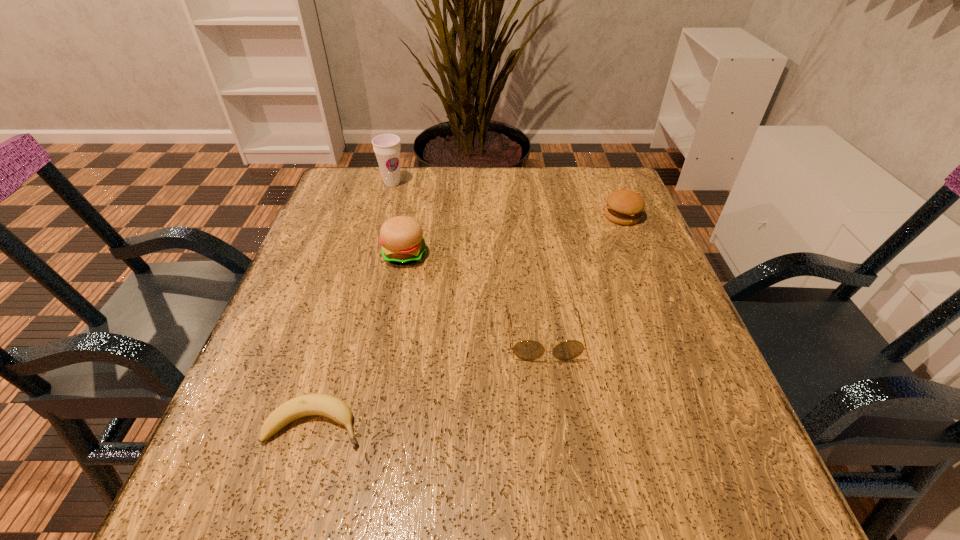
At what (x,y) coordinates should I click in order to perform the action: click on object that is at the far left corner. Please return your answer as a coordinate pair (x, y). This screenshot has width=960, height=540. Looking at the image, I should click on (387, 147).

Find the location of a particular element. object at the far right corner is located at coordinates (x=624, y=207).

You are a GUI agent. You are given a task and a screenshot of the screen. Output one action in this format:
    pyautogui.click(x=<x>, y=<y>)
    Task: Click on the blank space at the far edge of the desktop
    This screenshot has width=960, height=540.
    Given the screenshot: What is the action you would take?
    pyautogui.click(x=462, y=200)

Find the location of a particular element. The height and width of the screenshot is (540, 960). vacant space at the near edge of the desktop is located at coordinates (539, 509).

Locate an element on the screen. free space at the left edge of the desktop is located at coordinates (228, 413).

What are the coordinates of `free space at the right edge` in the screenshot? It's located at (668, 309).

Find the location of `free spot at the far left corner of the desktop`. free spot at the far left corner of the desktop is located at coordinates (391, 190).

The width and height of the screenshot is (960, 540). In the image, there is a desktop. Find the location of `free space at the far right corner`. free space at the far right corner is located at coordinates (565, 182).

Image resolution: width=960 pixels, height=540 pixels. I want to click on free space between the farthest object and the fourth farthest object, so click(x=468, y=260).

The image size is (960, 540). I want to click on free area in between the tallest object and the sunglasses, so click(468, 260).